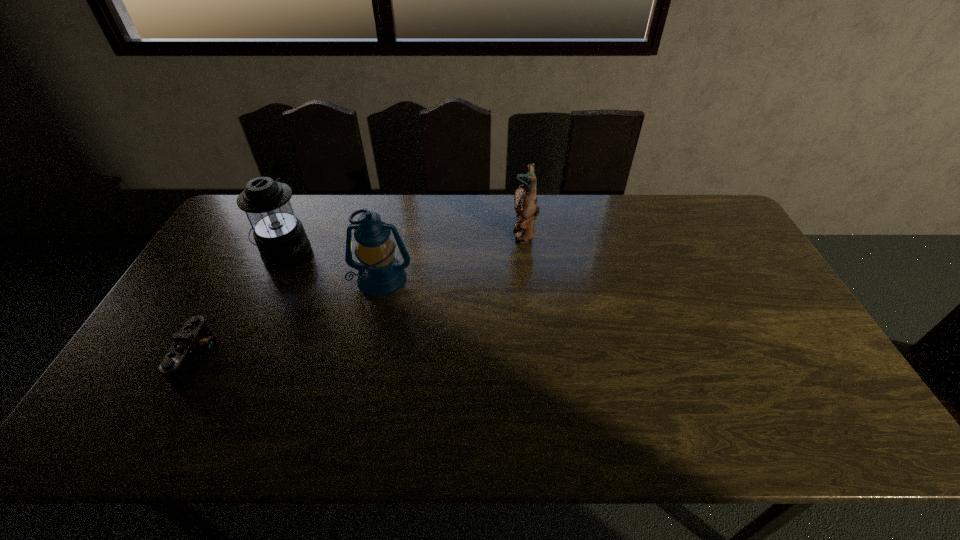
Locate an element on the screen. This screenshot has width=960, height=540. free space located 0.140m on the lens of the shortest object is located at coordinates (272, 360).

Identify the location of object situated at the far edge. The width and height of the screenshot is (960, 540). (526, 206).

Find the location of a particular element. The width and height of the screenshot is (960, 540). lantern positioned at the left edge is located at coordinates (279, 235).

Image resolution: width=960 pixels, height=540 pixels. I want to click on camera that is positioned at the left edge, so click(x=195, y=341).

Where is `vacant space at the far edge of the desktop`? vacant space at the far edge of the desktop is located at coordinates (326, 213).

What are the coordinates of `free space at the near edge of the desktop` in the screenshot? It's located at (224, 438).

This screenshot has width=960, height=540. I want to click on vacant space at the far left corner, so click(235, 237).

This screenshot has width=960, height=540. Find the location of `vacant region between the nearest object and the second object from right to left`. vacant region between the nearest object and the second object from right to left is located at coordinates (291, 320).

Identify the location of vacant area between the shortest object and the right lantern. This screenshot has width=960, height=540. (291, 320).

This screenshot has width=960, height=540. What are the coordinates of `vacant space that's between the rightmost object and the left lantern` in the screenshot? It's located at (404, 244).